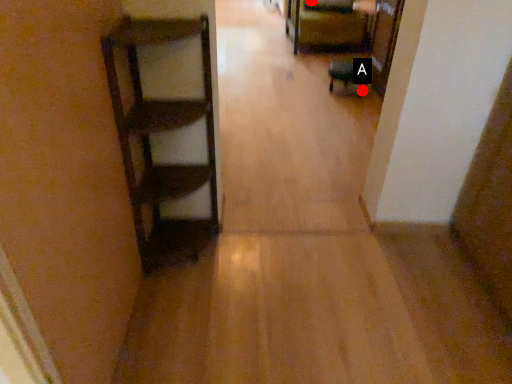
Question: Two points are circled on the image, labeled by A and B beside each circle. Which point is closer to the camera?

Choices:
 (A) A is closer
 (B) B is closer

Answer: (A)